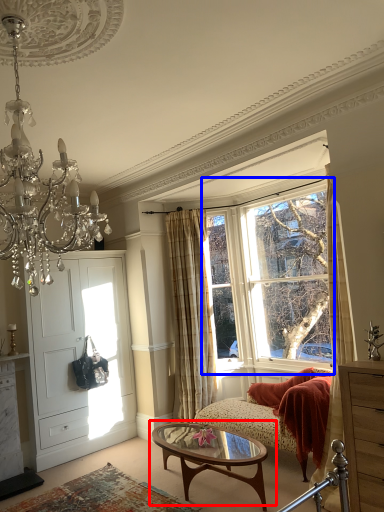
Question: Which point is further to the camera, coffee table (highlighted by a red box) or window (highlighted by a blue box)?

Choices:
 (A) coffee table
 (B) window

Answer: (B)